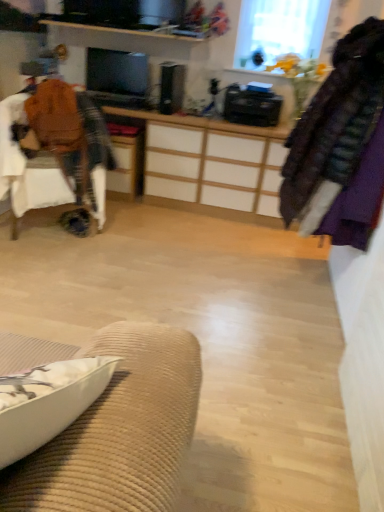
Question: Is velvet purple coat at right placed right next to brown fabric chair at left?

Choices:
 (A) no
 (B) yes

Answer: (A)

Question: Is the depth of velvet purple coat at right less than that of brown fabric chair at left?

Choices:
 (A) no
 (B) yes

Answer: (B)

Question: Can you confirm if velvet purple coat at right is thinner than brown fabric chair at left?

Choices:
 (A) no
 (B) yes

Answer: (B)

Question: Is velvet purple coat at right taller than brown fabric chair at left?

Choices:
 (A) no
 (B) yes

Answer: (B)

Question: Considering the relative positions of velvet purple coat at right and brown fabric chair at left in the image provided, is velvet purple coat at right to the right of brown fabric chair at left from the viewer's perspective?

Choices:
 (A) no
 (B) yes

Answer: (B)

Question: From the image's perspective, relative to white fabric cushion at lower left, is transparent glass window at upper center above or below?

Choices:
 (A) below
 (B) above

Answer: (B)

Question: Is transparent glass window at upper center to the left or to the right of white fabric cushion at lower left in the image?

Choices:
 (A) left
 (B) right

Answer: (B)

Question: Would you say transparent glass window at upper center is inside or outside white fabric cushion at lower left?

Choices:
 (A) inside
 (B) outside

Answer: (B)

Question: Considering the positions of transparent glass window at upper center and white fabric cushion at lower left in the image, is transparent glass window at upper center wider or thinner than white fabric cushion at lower left?

Choices:
 (A) thin
 (B) wide

Answer: (A)

Question: Is transparent glass window at upper center to the left or to the right of velvet purple coat at right in the image?

Choices:
 (A) left
 (B) right

Answer: (A)

Question: From their relative heights in the image, would you say transparent glass window at upper center is taller or shorter than velvet purple coat at right?

Choices:
 (A) tall
 (B) short

Answer: (B)

Question: Is transparent glass window at upper center bigger or smaller than velvet purple coat at right?

Choices:
 (A) small
 (B) big

Answer: (A)

Question: Does point (283, 32) appear closer or farther from the camera than point (375, 56)?

Choices:
 (A) closer
 (B) farther

Answer: (B)

Question: Relative to velvet purple coat at right, is white fabric cushion at lower left in front or behind?

Choices:
 (A) front
 (B) behind

Answer: (A)

Question: From the image's perspective, is white fabric cushion at lower left positioned above or below velvet purple coat at right?

Choices:
 (A) above
 (B) below

Answer: (B)